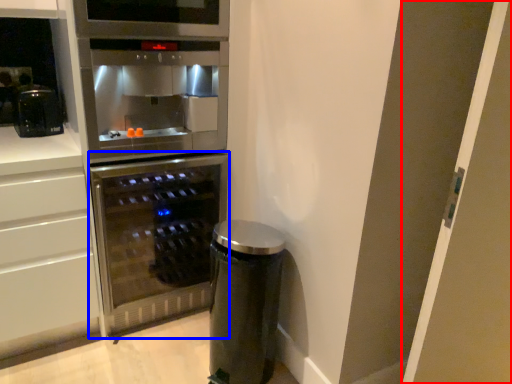
Question: Which of the following is the farthest to the observer, glass door (highlighted by a red box) or home appliance (highlighted by a blue box)?

Choices:
 (A) glass door
 (B) home appliance

Answer: (B)